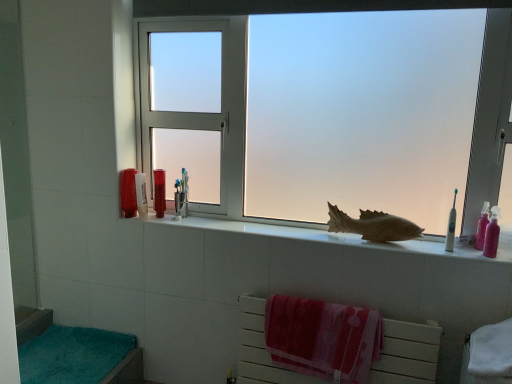
How much space does pink glossy toiletries at right, placed as the second toiletry when sorted from right to left, occupy horizontally?

It is 2.11 inches.

The height and width of the screenshot is (384, 512). What do you see at coordinates (141, 194) in the screenshot? I see `translucent plastic container at left, which is the 3th toiletry from front to back` at bounding box center [141, 194].

What is the approximate width of pink glossy toothbrush at right, which ranks as the 2th toiletry in front-to-back order?

It is 2.11 inches.

This screenshot has width=512, height=384. Identify the location of frosted glass window at center. (409, 8).

What is the approximate height of frosted glass window at center?

It is 1.04 meters.

I want to click on pink glossy toiletries at right, placed as the 5th toiletry when sorted from back to front, so click(x=492, y=234).

From a real-world perspective, which is physically below, red cotton towel at lower center or white ceramic fish at center?

In real-world perspective, red cotton towel at lower center is lower.

Between red cotton towel at lower center and white ceramic fish at center, which one appears on the left side from the viewer's perspective?

Positioned to the left is white ceramic fish at center.

Is red cotton towel at lower center facing away from white ceramic fish at center?

red cotton towel at lower center is not turned away from white ceramic fish at center.

Based on the photo, which of these two, red cotton towel at lower center or pink glossy toiletries at right, which appears as the 1th toiletry when viewed from the front, stands taller?

red cotton towel at lower center is taller.

Is red cotton towel at lower center facing towards pink glossy toiletries at right, which ranks as the fourth toiletry in left-to-right order?

No.

From a real-world perspective, is red cotton towel at lower center on pink glossy toiletries at right, placed as the 5th toiletry when sorted from back to front?

Actually, red cotton towel at lower center is physically below pink glossy toiletries at right, placed as the 5th toiletry when sorted from back to front, in the real world.

Does pink glossy toiletries at right, which ranks as the fourth toiletry in left-to-right order, have a greater width compared to translucent plastic cup at left, which is counted as the 1th toiletry, starting from the left?

No, pink glossy toiletries at right, which ranks as the fourth toiletry in left-to-right order, is not wider than translucent plastic cup at left, which is counted as the 1th toiletry, starting from the left.

Is pink glossy toiletries at right, placed as the second toiletry when sorted from right to left, smaller than translucent plastic cup at left, the 5th toiletry in the right-to-left sequence?

Yes, pink glossy toiletries at right, placed as the second toiletry when sorted from right to left, is smaller than translucent plastic cup at left, the 5th toiletry in the right-to-left sequence.

Is pink glossy toiletries at right, placed as the second toiletry when sorted from right to left, aimed at translucent plastic cup at left, which is counted as the 1th toiletry, starting from the left?

No, pink glossy toiletries at right, placed as the second toiletry when sorted from right to left, is not turned towards translucent plastic cup at left, which is counted as the 1th toiletry, starting from the left.

Between teal plush bath towel at lower left and translucent plastic container at left, the third toiletry when ordered from back to front, which one has smaller size?

translucent plastic container at left, the third toiletry when ordered from back to front.

Considering the relative sizes of teal plush bath towel at lower left and translucent plastic container at left, acting as the second toiletry starting from the left, in the image provided, is teal plush bath towel at lower left wider than translucent plastic container at left, acting as the second toiletry starting from the left,?

Correct, the width of teal plush bath towel at lower left exceeds that of translucent plastic container at left, acting as the second toiletry starting from the left.

From a real-world perspective, starting from the teal plush bath towel at lower left, which toiletry is the 3rd one vertically above it? Please provide its 2D coordinates.

[(141, 194)]

Is teal plush bath towel at lower left at the left side of translucent plastic container at left, which is the 3th toiletry from front to back?

Correct, you'll find teal plush bath towel at lower left to the left of translucent plastic container at left, which is the 3th toiletry from front to back.

Does brown matte fish at center have a greater height compared to teal plush bath towel at lower left?

Indeed, brown matte fish at center has a greater height compared to teal plush bath towel at lower left.

Is brown matte fish at center positioned far away from teal plush bath towel at lower left?

brown matte fish at center is far away from teal plush bath towel at lower left.

Considering the sizes of brown matte fish at center and teal plush bath towel at lower left in the image, is brown matte fish at center bigger or smaller than teal plush bath towel at lower left?

Clearly, brown matte fish at center is smaller in size than teal plush bath towel at lower left.

Is brown matte fish at center oriented away from teal plush bath towel at lower left?

No, brown matte fish at center's orientation is not away from teal plush bath towel at lower left.

Which object is wider, translucent plastic container at left, which is counted as the 4th toiletry, starting from the right, or white ceramic fish at center?

Wider between the two is white ceramic fish at center.

Who is shorter, translucent plastic container at left, which is counted as the 4th toiletry, starting from the right, or white ceramic fish at center?

With less height is white ceramic fish at center.

Does translucent plastic container at left, the third toiletry when ordered from back to front, have a larger size compared to white ceramic fish at center?

Actually, translucent plastic container at left, the third toiletry when ordered from back to front, might be smaller than white ceramic fish at center.

Does point (137, 178) come closer to viewer compared to point (483, 260)?

No, it is not.

Is translucent plastic cup at upper center, arranged as the 1th toiletry when viewed from the back, completely or partially inside translucent plastic container at left, which is the 3th toiletry from front to back?

No, translucent plastic cup at upper center, arranged as the 1th toiletry when viewed from the back, is located outside of translucent plastic container at left, which is the 3th toiletry from front to back.

Who is smaller, translucent plastic container at left, which is the 3th toiletry from front to back, or translucent plastic cup at upper center, arranged as the 1th toiletry when viewed from the back?

With smaller size is translucent plastic cup at upper center, arranged as the 1th toiletry when viewed from the back.

From the picture: From the image's perspective, is translucent plastic container at left, the third toiletry when ordered from back to front, positioned above or below translucent plastic cup at upper center, which is the third toiletry in right-to-left order?

translucent plastic container at left, the third toiletry when ordered from back to front, is situated lower than translucent plastic cup at upper center, which is the third toiletry in right-to-left order, in the image.

Consider the image. Can you tell me how much translucent plastic container at left, which is the 3th toiletry from front to back, and translucent plastic cup at upper center, which is the third toiletry in right-to-left order, differ in facing direction?

They differ by 0.004 degrees in their facing directions.

Identify the location of beach towel below the white ceramic fish at center (from a real-world perspective). (323, 338).

This screenshot has width=512, height=384. In the image, there is a pink glossy toiletries at right, which ranks as the fourth toiletry in left-to-right order. What are the coordinates of `beach towel below it (from the image's perspective)` in the screenshot? It's located at (323, 338).

From the image, which object appears to be farther from white ceramic fish at center, pink glossy toothbrush at right, which ranks as the 2th toiletry in front-to-back order, or translucent plastic cup at upper center, arranged as the 5th toiletry when viewed from the front?

pink glossy toothbrush at right, which ranks as the 2th toiletry in front-to-back order.

Which object lies nearer to the anchor point translucent plastic container at left, acting as the second toiletry starting from the left, pink glossy toothbrush at right, placed as the first toiletry when sorted from right to left, or frosted glass window at center?

Based on the image, frosted glass window at center appears to be nearer to translucent plastic container at left, acting as the second toiletry starting from the left.

Considering their positions, is frosted glass window at center positioned further to translucent plastic cup at upper center, the 3th toiletry from the left, than pink glossy toothbrush at right, the 4th toiletry positioned from the back?

pink glossy toothbrush at right, the 4th toiletry positioned from the back, lies further to translucent plastic cup at upper center, the 3th toiletry from the left, than the other object.

Looking at the image, which one is located closer to translucent plastic cup at upper center, the 3th toiletry from the left, teal plush bath towel at lower left or pink glossy toiletries at right, which appears as the 1th toiletry when viewed from the front?

teal plush bath towel at lower left lies closer to translucent plastic cup at upper center, the 3th toiletry from the left, than the other object.

Estimate the real-world distances between objects in this image. Which object is closer to translucent plastic cup at upper center, arranged as the 1th toiletry when viewed from the back, white ceramic fish at center or white plastic toothbrush at right?

white ceramic fish at center.

From the picture: Estimate the real-world distances between objects in this image. Which object is closer to red cotton towel at lower center, brown matte fish at center or translucent plastic container at left, the third toiletry when ordered from back to front?

The object closer to red cotton towel at lower center is brown matte fish at center.

When comparing their distances from pink glossy toothbrush at right, placed as the first toiletry when sorted from right to left, does red cotton towel at lower center or brown matte fish at center seem further?

Based on the image, red cotton towel at lower center appears to be further to pink glossy toothbrush at right, placed as the first toiletry when sorted from right to left.

Looking at this image, from the image, which object appears to be nearer to pink glossy toothbrush at right, the 4th toiletry positioned from the back, translucent plastic container at left, the third toiletry when ordered from back to front, or pink glossy toiletries at right, which ranks as the fourth toiletry in left-to-right order?

Based on the image, pink glossy toiletries at right, which ranks as the fourth toiletry in left-to-right order, appears to be nearer to pink glossy toothbrush at right, the 4th toiletry positioned from the back.

Find the location of a particular element. Image resolution: width=512 pixels, height=384 pixels. window sill between teal plush bath towel at lower left and brown matte fish at center is located at coordinates (335, 237).

The width and height of the screenshot is (512, 384). I want to click on beach towel located between translucent plastic cup at upper center, arranged as the 5th toiletry when viewed from the front, and pink glossy toothbrush at right, which appears as the fifth toiletry when viewed from the left, in the left-right direction, so click(x=323, y=338).

In order to click on window sill between translucent plastic container at left, the third toiletry when ordered from back to front, and red cotton towel at lower center, in the horizontal direction in this screenshot , I will do `click(335, 237)`.

Where is `fish between translucent plastic cup at left, which is counted as the 1th toiletry, starting from the left, and white plastic toothbrush at right, in the horizontal direction`? fish between translucent plastic cup at left, which is counted as the 1th toiletry, starting from the left, and white plastic toothbrush at right, in the horizontal direction is located at coordinates (373, 225).